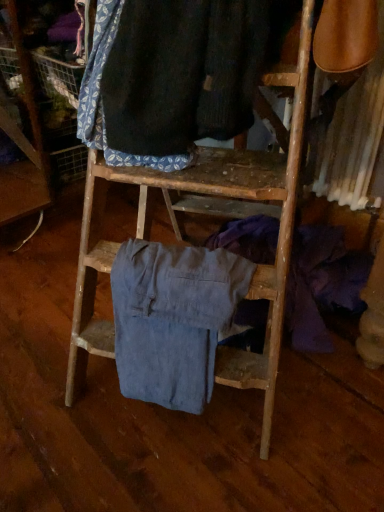
Find the location of `denim pants at center, positioned as the second clothing in top-to-bottom order`. denim pants at center, positioned as the second clothing in top-to-bottom order is located at coordinates (173, 319).

Describe the element at coordinates (173, 319) in the screenshot. I see `denim pants at center, positioned as the second clothing in top-to-bottom order` at that location.

What is the approximate height of denim pants at center, positioned as the second clothing in top-to-bottom order?

denim pants at center, positioned as the second clothing in top-to-bottom order, is 14.49 inches in height.

Measure the distance between denim pants at center, the first clothing in the bottom-to-top sequence, and camera.

A distance of 82.18 centimeters exists between denim pants at center, the first clothing in the bottom-to-top sequence, and camera.

What do you see at coordinates (174, 75) in the screenshot?
I see `dark blue fabric at upper center, marked as the 2th clothing in a bottom-to-top arrangement` at bounding box center [174, 75].

Find the location of a particular element. dark blue fabric at upper center, marked as the 2th clothing in a bottom-to-top arrangement is located at coordinates pos(174,75).

The height and width of the screenshot is (512, 384). In order to click on denim pants at center, the first clothing in the bottom-to-top sequence in this screenshot , I will do `click(173, 319)`.

Which is more to the left, denim pants at center, the first clothing in the bottom-to-top sequence, or dark blue fabric at upper center, which appears as the 1th clothing when viewed from the top?

denim pants at center, the first clothing in the bottom-to-top sequence, is more to the left.

Which is behind, denim pants at center, positioned as the second clothing in top-to-bottom order, or dark blue fabric at upper center, marked as the 2th clothing in a bottom-to-top arrangement?

Positioned behind is denim pants at center, positioned as the second clothing in top-to-bottom order.

Considering the positions of point (194, 277) and point (210, 83), is point (194, 277) closer or farther from the camera than point (210, 83)?

Point (194, 277) appears to be farther away from the viewer than point (210, 83).

From the image's perspective, does denim pants at center, the first clothing in the bottom-to-top sequence, appear lower than dark blue fabric at upper center, which appears as the 1th clothing when viewed from the top?

Indeed, from the image's perspective, denim pants at center, the first clothing in the bottom-to-top sequence, is shown beneath dark blue fabric at upper center, which appears as the 1th clothing when viewed from the top.

Looking at this image, from a real-world perspective, is denim pants at center, the first clothing in the bottom-to-top sequence, physically located above or below dark blue fabric at upper center, which appears as the 1th clothing when viewed from the top?

denim pants at center, the first clothing in the bottom-to-top sequence, is situated lower than dark blue fabric at upper center, which appears as the 1th clothing when viewed from the top, in the real world.

In the scene shown: Considering the sizes of objects denim pants at center, positioned as the second clothing in top-to-bottom order, and dark blue fabric at upper center, marked as the 2th clothing in a bottom-to-top arrangement, in the image provided, who is thinner, denim pants at center, positioned as the second clothing in top-to-bottom order, or dark blue fabric at upper center, marked as the 2th clothing in a bottom-to-top arrangement,?

With smaller width is denim pants at center, positioned as the second clothing in top-to-bottom order.

Is denim pants at center, positioned as the second clothing in top-to-bottom order, taller or shorter than dark blue fabric at upper center, which appears as the 1th clothing when viewed from the top?

In the image, denim pants at center, positioned as the second clothing in top-to-bottom order, appears to be taller than dark blue fabric at upper center, which appears as the 1th clothing when viewed from the top.

Looking at this image, which of these two, denim pants at center, positioned as the second clothing in top-to-bottom order, or dark blue fabric at upper center, which appears as the 1th clothing when viewed from the top, is bigger?

dark blue fabric at upper center, which appears as the 1th clothing when viewed from the top, is bigger.

Is denim pants at center, the first clothing in the bottom-to-top sequence, positioned beyond the bounds of dark blue fabric at upper center, which appears as the 1th clothing when viewed from the top?

denim pants at center, the first clothing in the bottom-to-top sequence, lies outside dark blue fabric at upper center, which appears as the 1th clothing when viewed from the top,'s area.

Is there a large distance between denim pants at center, the first clothing in the bottom-to-top sequence, and dark blue fabric at upper center, marked as the 2th clothing in a bottom-to-top arrangement?

Actually, denim pants at center, the first clothing in the bottom-to-top sequence, and dark blue fabric at upper center, marked as the 2th clothing in a bottom-to-top arrangement, are a little close together.

Is denim pants at center, positioned as the second clothing in top-to-bottom order, aimed at dark blue fabric at upper center, which appears as the 1th clothing when viewed from the top?

No, denim pants at center, positioned as the second clothing in top-to-bottom order, is not facing towards dark blue fabric at upper center, which appears as the 1th clothing when viewed from the top.

Can you tell me how much denim pants at center, positioned as the second clothing in top-to-bottom order, and dark blue fabric at upper center, marked as the 2th clothing in a bottom-to-top arrangement, differ in facing direction?

The angle between the facing direction of denim pants at center, positioned as the second clothing in top-to-bottom order, and the facing direction of dark blue fabric at upper center, marked as the 2th clothing in a bottom-to-top arrangement, is 0.000514 degrees.

Find the location of a particular element. clothing on the left of the dark blue fabric at upper center, marked as the 2th clothing in a bottom-to-top arrangement is located at coordinates (173, 319).

Considering the relative positions of dark blue fabric at upper center, marked as the 2th clothing in a bottom-to-top arrangement, and denim pants at center, the first clothing in the bottom-to-top sequence, in the image provided, is dark blue fabric at upper center, marked as the 2th clothing in a bottom-to-top arrangement, to the right of denim pants at center, the first clothing in the bottom-to-top sequence, from the viewer's perspective?

Indeed, dark blue fabric at upper center, marked as the 2th clothing in a bottom-to-top arrangement, is positioned on the right side of denim pants at center, the first clothing in the bottom-to-top sequence.

Is the depth of dark blue fabric at upper center, which appears as the 1th clothing when viewed from the top, less than that of denim pants at center, the first clothing in the bottom-to-top sequence?

Yes, dark blue fabric at upper center, which appears as the 1th clothing when viewed from the top, is closer to the camera.

Is point (109, 7) positioned after point (200, 280)?

No.

From the image's perspective, is dark blue fabric at upper center, marked as the 2th clothing in a bottom-to-top arrangement, below denim pants at center, positioned as the second clothing in top-to-bottom order?

No, from the image's perspective, dark blue fabric at upper center, marked as the 2th clothing in a bottom-to-top arrangement, is not below denim pants at center, positioned as the second clothing in top-to-bottom order.

From a real-world perspective, which object stands above the other?

dark blue fabric at upper center, marked as the 2th clothing in a bottom-to-top arrangement, from a real-world perspective.

In terms of width, does dark blue fabric at upper center, which appears as the 1th clothing when viewed from the top, look wider or thinner when compared to denim pants at center, positioned as the second clothing in top-to-bottom order?

Considering their sizes, dark blue fabric at upper center, which appears as the 1th clothing when viewed from the top, looks broader than denim pants at center, positioned as the second clothing in top-to-bottom order.

Considering the sizes of objects dark blue fabric at upper center, which appears as the 1th clothing when viewed from the top, and denim pants at center, the first clothing in the bottom-to-top sequence, in the image provided, who is shorter, dark blue fabric at upper center, which appears as the 1th clothing when viewed from the top, or denim pants at center, the first clothing in the bottom-to-top sequence,?

With less height is dark blue fabric at upper center, which appears as the 1th clothing when viewed from the top.

Considering the relative sizes of dark blue fabric at upper center, which appears as the 1th clothing when viewed from the top, and denim pants at center, positioned as the second clothing in top-to-bottom order, in the image provided, is dark blue fabric at upper center, which appears as the 1th clothing when viewed from the top, bigger than denim pants at center, positioned as the second clothing in top-to-bottom order,?

Correct, dark blue fabric at upper center, which appears as the 1th clothing when viewed from the top, is larger in size than denim pants at center, positioned as the second clothing in top-to-bottom order.

From the picture: Would you say dark blue fabric at upper center, which appears as the 1th clothing when viewed from the top, is inside or outside denim pants at center, the first clothing in the bottom-to-top sequence?

dark blue fabric at upper center, which appears as the 1th clothing when viewed from the top, is not inside denim pants at center, the first clothing in the bottom-to-top sequence, it's outside.

Is dark blue fabric at upper center, which appears as the 1th clothing when viewed from the top, not close to denim pants at center, positioned as the second clothing in top-to-bottom order?

No.

Is denim pants at center, positioned as the second clothing in top-to-bottom order, at the back of dark blue fabric at upper center, which appears as the 1th clothing when viewed from the top?

dark blue fabric at upper center, which appears as the 1th clothing when viewed from the top, is not turned away from denim pants at center, positioned as the second clothing in top-to-bottom order.

Can you tell me how much dark blue fabric at upper center, marked as the 2th clothing in a bottom-to-top arrangement, and denim pants at center, positioned as the second clothing in top-to-bottom order, differ in facing direction?

The angle between the facing direction of dark blue fabric at upper center, marked as the 2th clothing in a bottom-to-top arrangement, and the facing direction of denim pants at center, positioned as the second clothing in top-to-bottom order, is 0.000514 degrees.

Could you measure the distance between dark blue fabric at upper center, which appears as the 1th clothing when viewed from the top, and denim pants at center, the first clothing in the bottom-to-top sequence?

32.86 centimeters.

Locate an element on the screen. The height and width of the screenshot is (512, 384). clothing that appears on the left of dark blue fabric at upper center, marked as the 2th clothing in a bottom-to-top arrangement is located at coordinates (173, 319).

Where is `clothing above the denim pants at center, positioned as the second clothing in top-to-bottom order (from a real-world perspective)`? clothing above the denim pants at center, positioned as the second clothing in top-to-bottom order (from a real-world perspective) is located at coordinates (174, 75).

Find the location of a particular element. This screenshot has height=512, width=384. clothing that is on the right side of denim pants at center, positioned as the second clothing in top-to-bottom order is located at coordinates (174, 75).